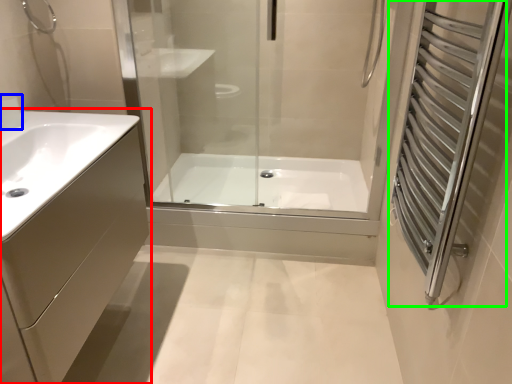
Question: Which object is positioned closest to bathroom cabinet (highlighted by a red box)? Select from faucet (highlighted by a blue box) and screen door (highlighted by a green box).

Choices:
 (A) faucet
 (B) screen door

Answer: (A)